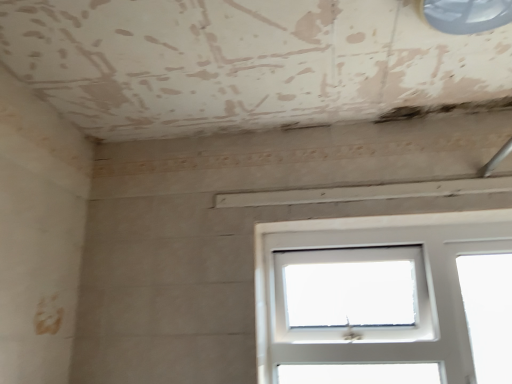
This screenshot has height=384, width=512. I want to click on white plastic window at center, which appears as the 2th window when viewed from the front, so click(373, 260).

What do you see at coordinates (373, 260) in the screenshot? I see `white plastic window at center, the 1th window ordered from the bottom` at bounding box center [373, 260].

Where is `transparent plastic window at upper right, the first window from the top`? The width and height of the screenshot is (512, 384). transparent plastic window at upper right, the first window from the top is located at coordinates (467, 15).

The image size is (512, 384). What do you see at coordinates (467, 15) in the screenshot?
I see `transparent plastic window at upper right, the second window viewed from the back` at bounding box center [467, 15].

Where is `white plastic window at center, positioned as the 1th window in back-to-front order`? Image resolution: width=512 pixels, height=384 pixels. white plastic window at center, positioned as the 1th window in back-to-front order is located at coordinates (373, 260).

Is white plastic window at center, which appears as the 2th window when viewed from the front, at the left side of transparent plastic window at upper right, the second window viewed from the back?

No.

Which object is further away from the camera, white plastic window at center, which appears as the 2th window when viewed from the front, or transparent plastic window at upper right, acting as the 2th window starting from the bottom?

Positioned behind is white plastic window at center, which appears as the 2th window when viewed from the front.

Which point is more distant from viewer, (330,346) or (498,13)?

The point (330,346) is farther from the camera.

From the image's perspective, is white plastic window at center, which appears as the 2th window when viewed from the front, located beneath transparent plastic window at upper right, acting as the 2th window starting from the bottom?

Yes.

From a real-world perspective, is white plastic window at center, the 1th window ordered from the bottom, located beneath transparent plastic window at upper right, placed as the first window when sorted from front to back?

Correct, in the physical world, white plastic window at center, the 1th window ordered from the bottom, is lower than transparent plastic window at upper right, placed as the first window when sorted from front to back.

Between white plastic window at center, positioned as the 1th window in back-to-front order, and transparent plastic window at upper right, placed as the first window when sorted from front to back, which one has smaller width?

white plastic window at center, positioned as the 1th window in back-to-front order.

Between white plastic window at center, positioned as the 1th window in back-to-front order, and transparent plastic window at upper right, the second window viewed from the back, which one has more height?

With more height is white plastic window at center, positioned as the 1th window in back-to-front order.

Can you confirm if white plastic window at center, positioned as the 1th window in back-to-front order, is smaller than transparent plastic window at upper right, placed as the first window when sorted from front to back?

No.

Is transparent plastic window at upper right, acting as the 2th window starting from the bottom, located within white plastic window at center, the 1th window ordered from the bottom?

That's incorrect, transparent plastic window at upper right, acting as the 2th window starting from the bottom, is not inside white plastic window at center, the 1th window ordered from the bottom.

Would you say white plastic window at center, positioned as the 1th window in back-to-front order, is a long distance from transparent plastic window at upper right, the second window viewed from the back?

white plastic window at center, positioned as the 1th window in back-to-front order, is near transparent plastic window at upper right, the second window viewed from the back, not far away.

Is white plastic window at center, positioned as the 1th window in back-to-front order, turned away from transparent plastic window at upper right, the second window viewed from the back?

No, transparent plastic window at upper right, the second window viewed from the back, is not at the back of white plastic window at center, positioned as the 1th window in back-to-front order.

Measure the distance from white plastic window at center, the 1th window ordered from the bottom, to transparent plastic window at upper right, acting as the 2th window starting from the bottom.

white plastic window at center, the 1th window ordered from the bottom, is 34.46 inches away from transparent plastic window at upper right, acting as the 2th window starting from the bottom.

I want to click on window above the white plastic window at center, positioned as the 1th window in back-to-front order (from a real-world perspective), so click(467, 15).

Can you confirm if transparent plastic window at upper right, the second window viewed from the back, is positioned to the left of white plastic window at center, positioned as the 1th window in back-to-front order?

Indeed, transparent plastic window at upper right, the second window viewed from the back, is positioned on the left side of white plastic window at center, positioned as the 1th window in back-to-front order.

From the picture: Is the position of transparent plastic window at upper right, placed as the first window when sorted from front to back, less distant than that of white plastic window at center, the 1th window ordered from the bottom?

Yes, transparent plastic window at upper right, placed as the first window when sorted from front to back, is in front of white plastic window at center, the 1th window ordered from the bottom.

Is point (430, 24) closer to viewer compared to point (450, 325)?

Yes, point (430, 24) is closer to viewer.

From the image's perspective, is transparent plastic window at upper right, the second window viewed from the back, above white plastic window at center, acting as the second window starting from the top?

Indeed, from the image's perspective, transparent plastic window at upper right, the second window viewed from the back, is shown above white plastic window at center, acting as the second window starting from the top.

From a real-world perspective, is transparent plastic window at upper right, placed as the first window when sorted from front to back, on white plastic window at center, which appears as the 2th window when viewed from the front?

Yes, from a real-world perspective, transparent plastic window at upper right, placed as the first window when sorted from front to back, is over white plastic window at center, which appears as the 2th window when viewed from the front

Which object is thinner, transparent plastic window at upper right, the first window from the top, or white plastic window at center, acting as the second window starting from the top?

white plastic window at center, acting as the second window starting from the top.

Which of these two, transparent plastic window at upper right, the first window from the top, or white plastic window at center, which appears as the 2th window when viewed from the front, stands shorter?

transparent plastic window at upper right, the first window from the top.

Is transparent plastic window at upper right, the second window viewed from the back, bigger or smaller than white plastic window at center, positioned as the 1th window in back-to-front order?

transparent plastic window at upper right, the second window viewed from the back, is smaller than white plastic window at center, positioned as the 1th window in back-to-front order.

Is transparent plastic window at upper right, acting as the 2th window starting from the bottom, inside the boundaries of white plastic window at center, which appears as the 2th window when viewed from the front, or outside?

transparent plastic window at upper right, acting as the 2th window starting from the bottom, is not enclosed by white plastic window at center, which appears as the 2th window when viewed from the front.

Is transparent plastic window at upper right, the first window from the top, positioned far away from white plastic window at center, acting as the second window starting from the top?

No, transparent plastic window at upper right, the first window from the top, is not far away from white plastic window at center, acting as the second window starting from the top.

Is transparent plastic window at upper right, acting as the 2th window starting from the bottom, facing towards white plastic window at center, which appears as the 2th window when viewed from the front?

No, transparent plastic window at upper right, acting as the 2th window starting from the bottom, is not turned towards white plastic window at center, which appears as the 2th window when viewed from the front.

How many degrees apart are the facing directions of transparent plastic window at upper right, the second window viewed from the back, and white plastic window at center, which appears as the 2th window when viewed from the front?

0.607 degrees.

Measure the distance between transparent plastic window at upper right, placed as the first window when sorted from front to back, and white plastic window at center, the 1th window ordered from the bottom.

transparent plastic window at upper right, placed as the first window when sorted from front to back, and white plastic window at center, the 1th window ordered from the bottom, are 34.46 inches apart from each other.

Identify the location of window above the white plastic window at center, the 1th window ordered from the bottom (from the image's perspective). (467, 15).

This screenshot has width=512, height=384. In the image, there is a transparent plastic window at upper right, the second window viewed from the back. In order to click on window below it (from a real-world perspective) in this screenshot , I will do `click(373, 260)`.

Find the location of a particular element. The height and width of the screenshot is (384, 512). window below the transparent plastic window at upper right, the second window viewed from the back (from the image's perspective) is located at coordinates (373, 260).